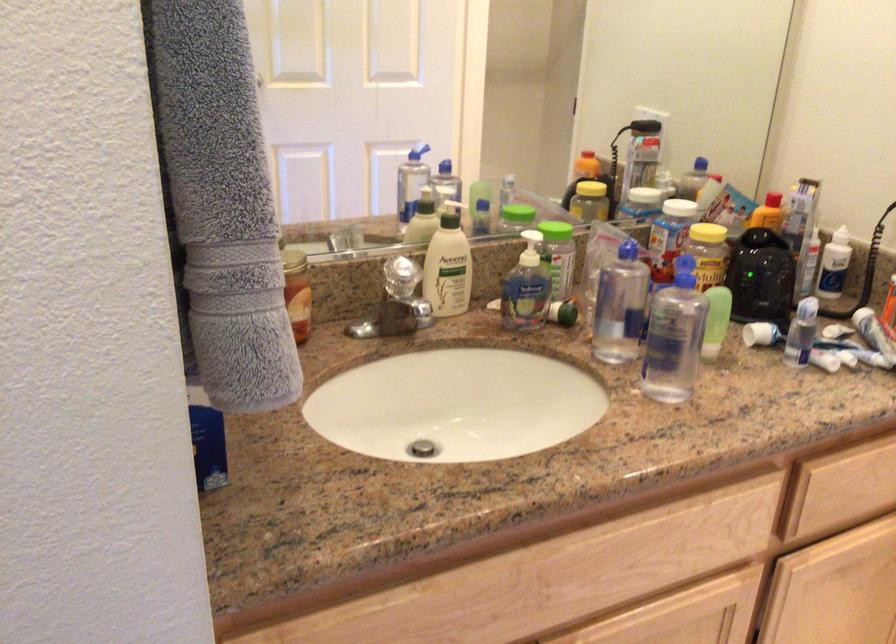
The height and width of the screenshot is (644, 896). What do you see at coordinates (440, 17) in the screenshot?
I see `a reflected door knob` at bounding box center [440, 17].